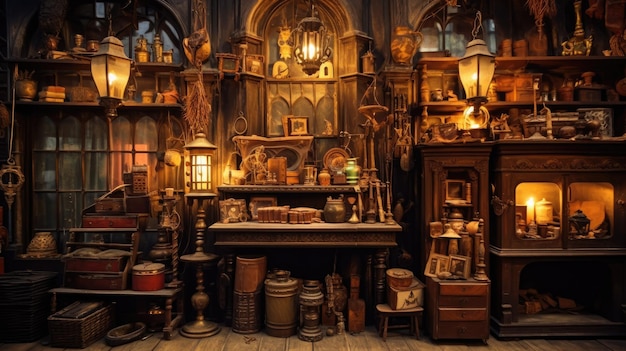
Find the location of a particular element. wood floor is located at coordinates (223, 343).